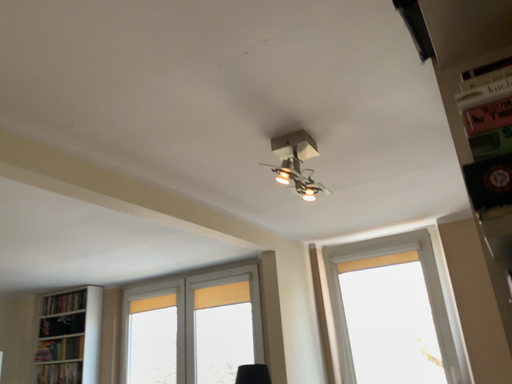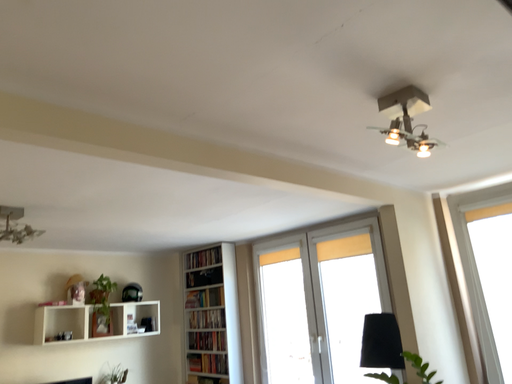
Question: Which way did the camera rotate in the video?

Choices:
 (A) rotated downward
 (B) rotated upward

Answer: (A)